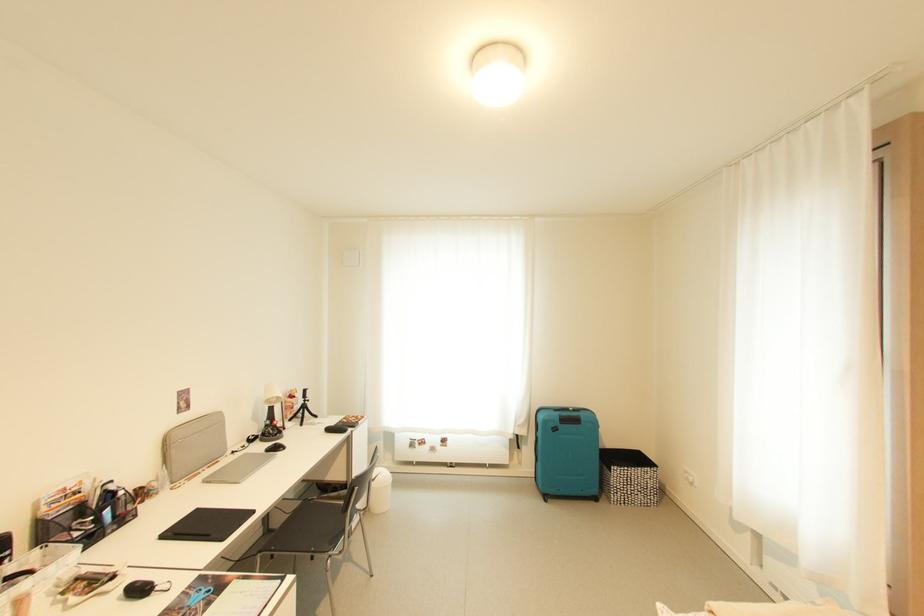
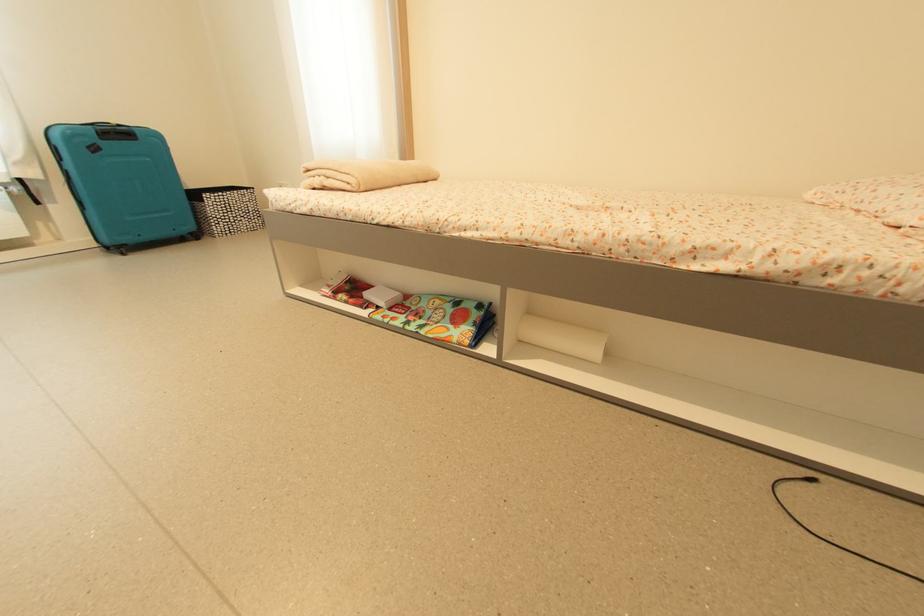
Find the pixel in the second image that matches [617,482] in the first image.

(213, 212)